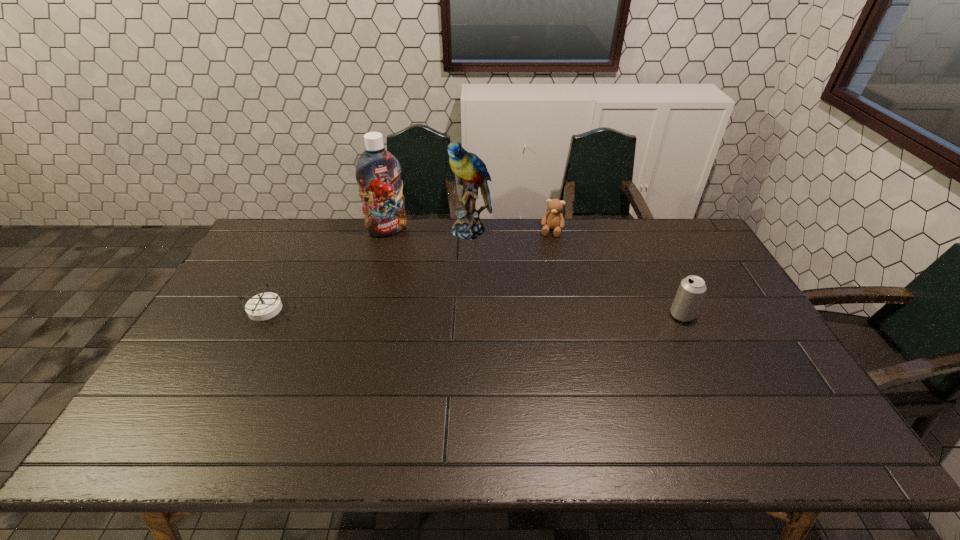
Find the location of a particular element. This screenshot has height=540, width=960. vacant space that's between the second object from left to right and the beer can is located at coordinates (535, 273).

Locate an element on the screen. The width and height of the screenshot is (960, 540). empty space that is in between the shortest object and the fourth object from left to right is located at coordinates (408, 270).

The width and height of the screenshot is (960, 540). I want to click on vacant space that is in between the parrot and the second object from right to left, so (512, 231).

You are a GUI agent. You are given a task and a screenshot of the screen. Output one action in this format:
    pyautogui.click(x=<x>, y=<y>)
    Task: Click on the vacant region between the third object from left to right and the beer can
    This screenshot has height=540, width=960.
    Given the screenshot: What is the action you would take?
    pyautogui.click(x=577, y=273)

Locate which object is the closest to the shampoo. Please provide its 2D coordinates. Your answer should be formatted as a tuple, i.e. [(x, y)], where the tuple contains the x and y coordinates of a point satisfying the conditions above.

[(471, 171)]

Point out which object is positioned as the second nearest to the fourth object from left to right. Please provide its 2D coordinates. Your answer should be formatted as a tuple, i.e. [(x, y)], where the tuple contains the x and y coordinates of a point satisfying the conditions above.

[(691, 291)]

At what (x,y) coordinates should I click in order to perform the action: click on vacant area in the image that satisfies the following two spatial constraints: 1. on the front side of the shampoo; 2. on the left side of the teddy bear. Please return your answer as a coordinate pair (x, y). Looking at the image, I should click on (388, 231).

At what (x,y) coordinates should I click in order to perform the action: click on vacant space that satisfies the following two spatial constraints: 1. on the back side of the parrot; 2. on the right side of the fourth object from left to right. Please return your answer as a coordinate pair (x, y). The image size is (960, 540). Looking at the image, I should click on (472, 231).